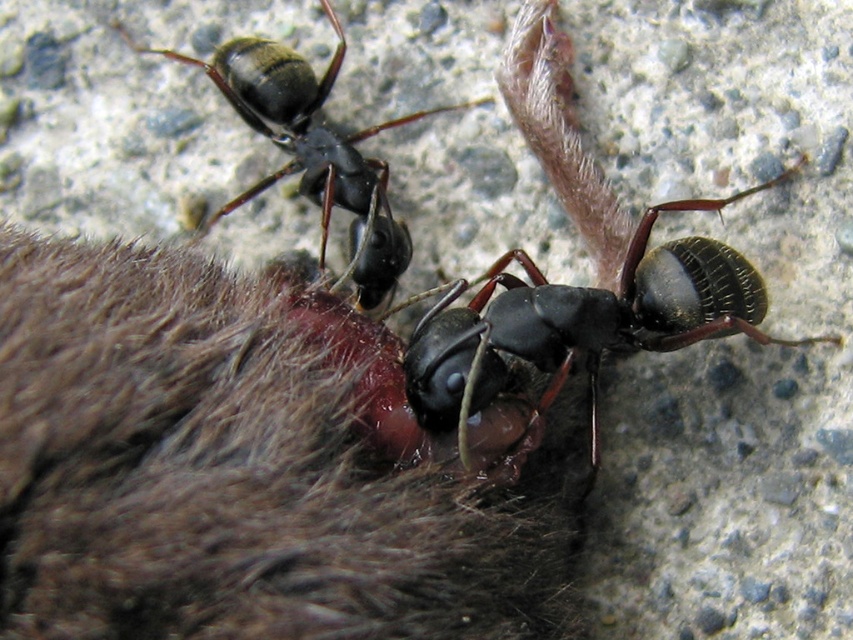
Who is more distant from viewer, (444, 424) or (372, 221)?

The point (372, 221) is more distant.

Is shiny black ant at center taller than shiny black ant at upper left?

Yes.

Is point (628, 280) positioned in front of point (369, 294)?

Yes, it is.

The image size is (853, 640). In order to click on shiny black ant at center in this screenshot , I will do `click(572, 285)`.

Who is taller, brown fuzzy fur at center or shiny black ant at upper left?

Standing taller between the two is shiny black ant at upper left.

Which is more to the left, brown fuzzy fur at center or shiny black ant at upper left?

Positioned to the left is shiny black ant at upper left.

Is point (6, 458) behind point (368, 132)?

No, it is in front of (368, 132).

This screenshot has width=853, height=640. What are the coordinates of `brown fuzzy fur at center` in the screenshot? It's located at (235, 472).

Is brown fuzzy fur at center in front of shiny black ant at center?

Yes, brown fuzzy fur at center is in front of shiny black ant at center.

Can you confirm if brown fuzzy fur at center is wider than shiny black ant at center?

Indeed, brown fuzzy fur at center has a greater width compared to shiny black ant at center.

Locate an element on the screen. This screenshot has width=853, height=640. brown fuzzy fur at center is located at coordinates tap(235, 472).